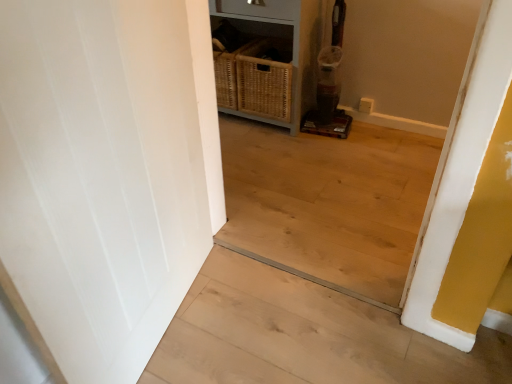
Question: Is white wood stairwell at left bigger or smaller than woven wood dresser at center?

Choices:
 (A) small
 (B) big

Answer: (A)

Question: From their relative heights in the image, would you say white wood stairwell at left is taller or shorter than woven wood dresser at center?

Choices:
 (A) short
 (B) tall

Answer: (A)

Question: Is white wood stairwell at left situated inside woven wood dresser at center or outside?

Choices:
 (A) outside
 (B) inside

Answer: (A)

Question: Is point (263, 71) closer or farther from the camera than point (310, 311)?

Choices:
 (A) closer
 (B) farther

Answer: (B)

Question: Is woven wood dresser at center bigger or smaller than white wood stairwell at left?

Choices:
 (A) big
 (B) small

Answer: (A)

Question: In terms of height, does woven wood dresser at center look taller or shorter compared to white wood stairwell at left?

Choices:
 (A) tall
 (B) short

Answer: (A)

Question: Looking at their shapes, would you say woven wood dresser at center is wider or thinner than white wood stairwell at left?

Choices:
 (A) thin
 (B) wide

Answer: (A)